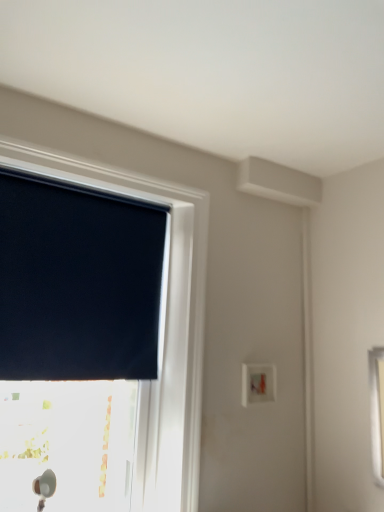
Question: Considering the positions of point (180, 430) and point (271, 367), is point (180, 430) closer or farther from the camera than point (271, 367)?

Choices:
 (A) farther
 (B) closer

Answer: (B)

Question: From a real-world perspective, is black matte window at upper left physically located above or below white plastic light switch at center-right?

Choices:
 (A) below
 (B) above

Answer: (B)

Question: Which is nearer to the black matte window at upper left?

Choices:
 (A) dark blue fabric at upper left
 (B) white plastic light switch at center-right

Answer: (A)

Question: Which object is positioned closest to the black matte window at upper left?

Choices:
 (A) white plastic light switch at center-right
 (B) dark blue fabric at upper left

Answer: (B)